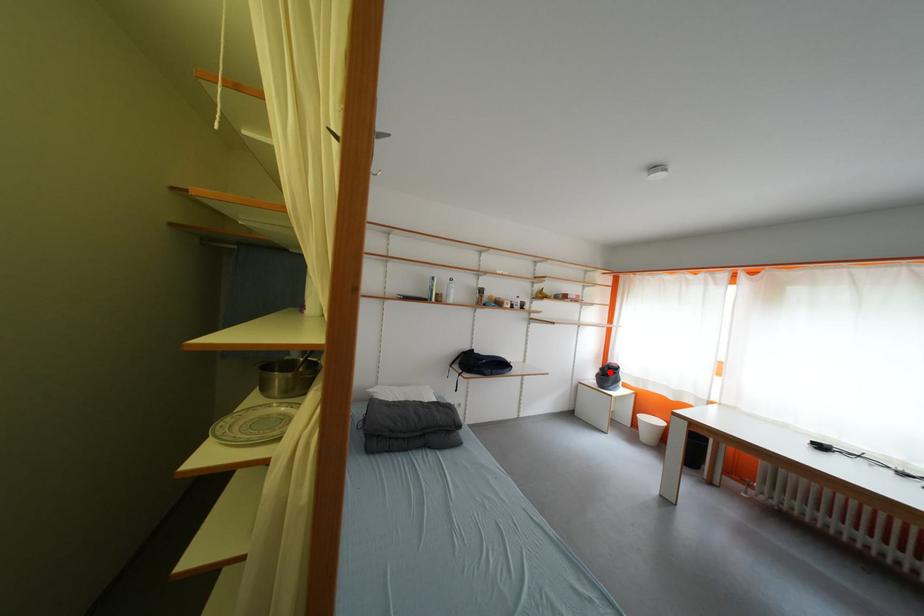
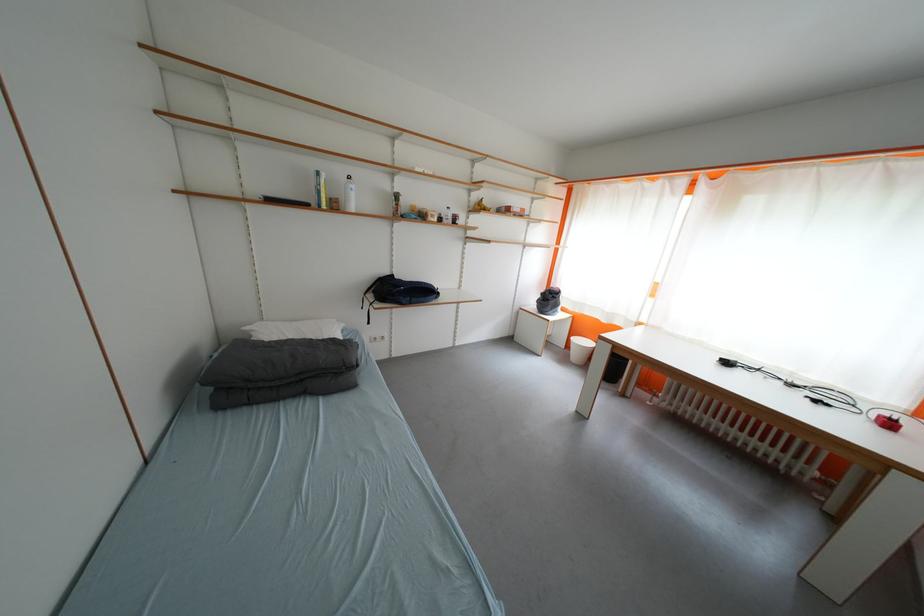
Question: I am providing you with two images of the same scene from different viewpoints. A red point is marked on the first image. At the location where the point appears in image 1, is it still visible in image 2?

Choices:
 (A) Yes
 (B) No

Answer: (A)